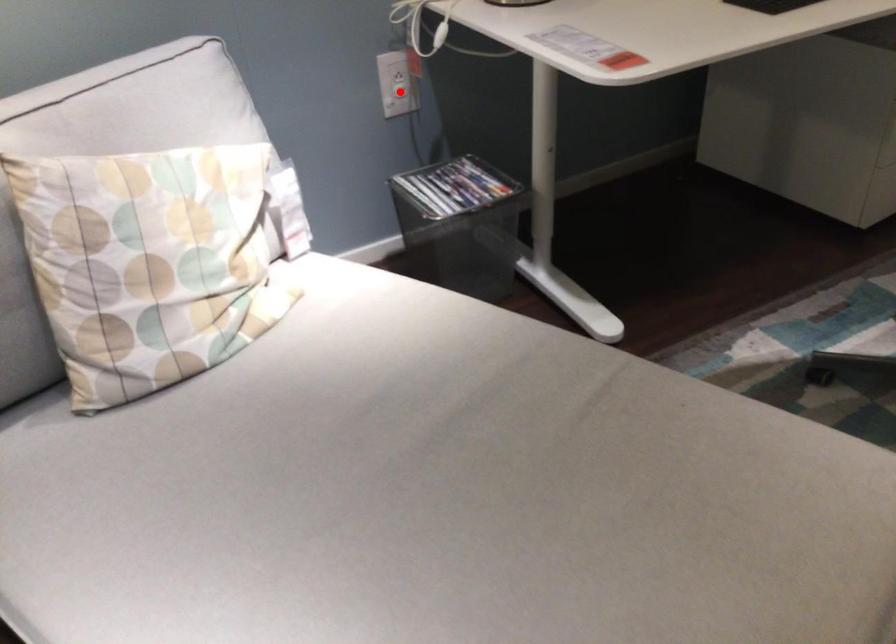
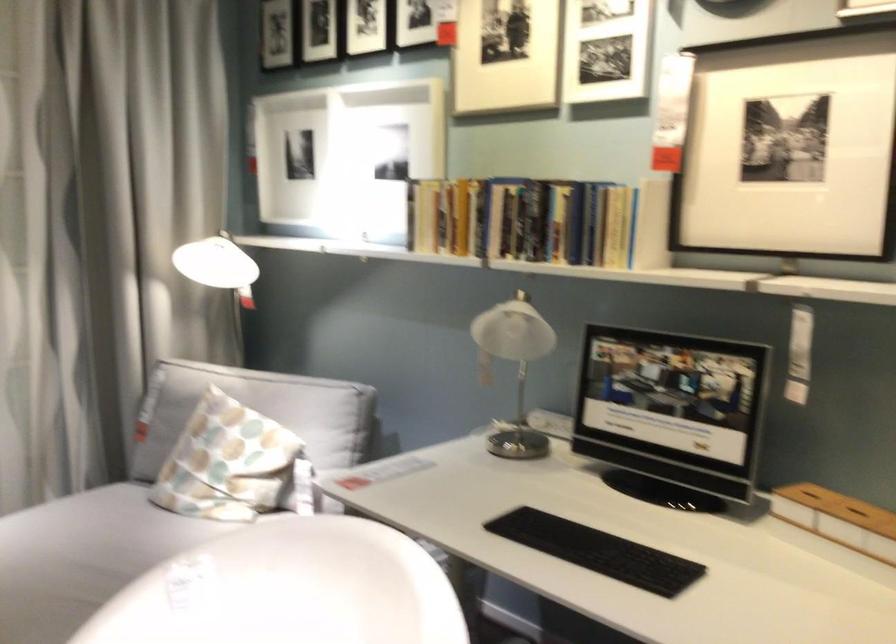
Question: I am providing you with two images of the same scene from different viewpoints. A red point is marked on the first image. Can you still see the location of the red point in image 2?

Choices:
 (A) Yes
 (B) No

Answer: (B)